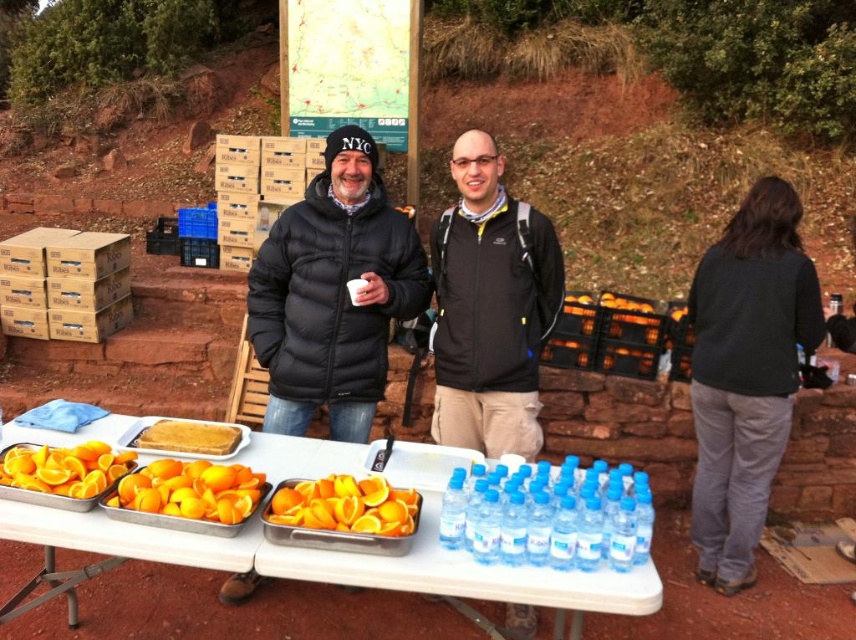
You are organizing items on a table and need to place the dark gray sweater at right and the clear plastic water bottle at center. If you want to ensure the sweater doesn not block the view of the water bottle, where should you position them?

The dark gray sweater at right is larger than the clear plastic water bottle at center. To prevent blocking the view of the water bottle, place the sweater behind or to the side of the water bottle so its larger size doesn not obscure it.

You are standing at the origin of the coordinate system in the image. You need to walk to the point labeled point (714, 308). However, there is an obstacle at point (367, 200). Will you be able to see the target point after passing the obstacle?

Since point (714, 308) is behind point (367, 200), you will not be able to see the target point after passing the obstacle at point (367, 200) because it is obstructed by the obstacle.

You are organizing a winter clothing drive and need to determine which item can accommodate a larger person. Based on the scene, which item between the dark gray sweater at right and the black puffer jacket at center would be more suitable for a bigger individual?

The dark gray sweater at right has a larger size compared to the black puffer jacket at center, so it would be more suitable for a bigger individual.